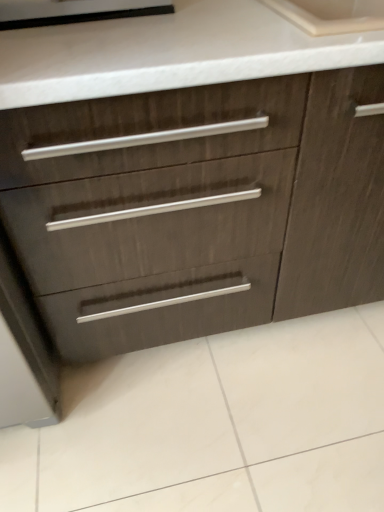
Question: Is the depth of dark wood cabinet at center less than that of black rubber seal at upper left?

Choices:
 (A) yes
 (B) no

Answer: (A)

Question: Can you confirm if dark wood cabinet at center is shorter than black rubber seal at upper left?

Choices:
 (A) yes
 (B) no

Answer: (B)

Question: Is dark wood cabinet at center further to the viewer compared to black rubber seal at upper left?

Choices:
 (A) yes
 (B) no

Answer: (B)

Question: Would you say black rubber seal at upper left is part of dark wood cabinet at center's contents?

Choices:
 (A) yes
 (B) no

Answer: (B)

Question: Considering the relative sizes of dark wood cabinet at center and black rubber seal at upper left in the image provided, is dark wood cabinet at center smaller than black rubber seal at upper left?

Choices:
 (A) no
 (B) yes

Answer: (A)

Question: From the image's perspective, is dark wood cabinet at center beneath black rubber seal at upper left?

Choices:
 (A) yes
 (B) no

Answer: (A)

Question: Can you confirm if black rubber seal at upper left is positioned to the left of dark wood cabinet at center?

Choices:
 (A) no
 (B) yes

Answer: (B)

Question: From a real-world perspective, is black rubber seal at upper left physically below dark wood cabinet at center?

Choices:
 (A) no
 (B) yes

Answer: (A)

Question: Considering the relative sizes of black rubber seal at upper left and dark wood cabinet at center in the image provided, is black rubber seal at upper left smaller than dark wood cabinet at center?

Choices:
 (A) no
 (B) yes

Answer: (B)

Question: Is black rubber seal at upper left to the right of dark wood cabinet at center from the viewer's perspective?

Choices:
 (A) no
 (B) yes

Answer: (A)

Question: Is black rubber seal at upper left oriented away from dark wood cabinet at center?

Choices:
 (A) no
 (B) yes

Answer: (A)

Question: Are black rubber seal at upper left and dark wood cabinet at center beside each other?

Choices:
 (A) no
 (B) yes

Answer: (A)

Question: Does point (23, 20) appear closer or farther from the camera than point (233, 174)?

Choices:
 (A) closer
 (B) farther

Answer: (A)